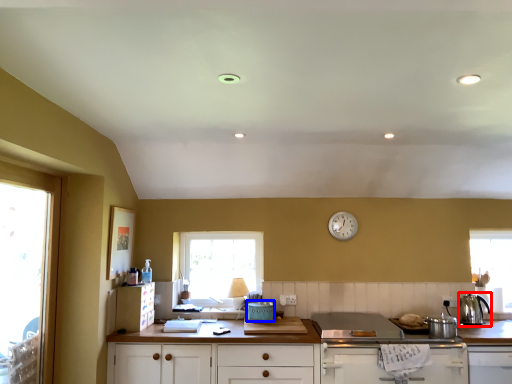
Question: Which object is further to the camera taking this photo, kitchen appliance (highlighted by a red box) or appliance (highlighted by a blue box)?

Choices:
 (A) kitchen appliance
 (B) appliance

Answer: (B)